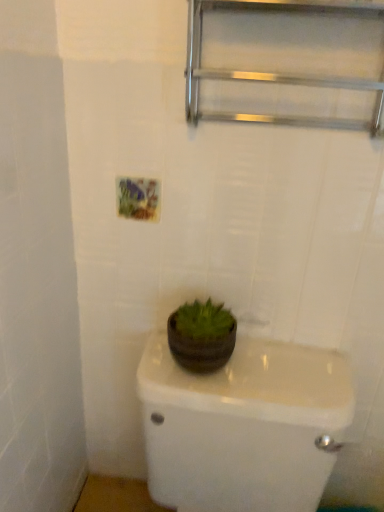
This screenshot has height=512, width=384. I want to click on free spot below metallic silver shelf at upper center (from a real-world perspective), so click(x=280, y=359).